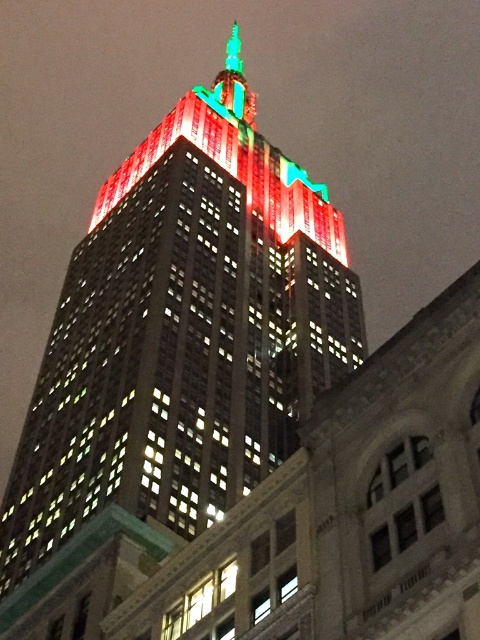
Question: Can you confirm if matte glass skyscraper at center is wider than shiny glass spire at upper center?

Choices:
 (A) no
 (B) yes

Answer: (B)

Question: Among these points, which one is nearest to the camera?

Choices:
 (A) (220, 100)
 (B) (194, 355)

Answer: (B)

Question: Among these points, which one is nearest to the camera?

Choices:
 (A) (85, 266)
 (B) (228, 99)

Answer: (A)

Question: Does matte glass skyscraper at center have a larger size compared to shiny glass spire at upper center?

Choices:
 (A) yes
 (B) no

Answer: (B)

Question: Can you confirm if matte glass skyscraper at center is positioned below shiny glass spire at upper center?

Choices:
 (A) yes
 (B) no

Answer: (A)